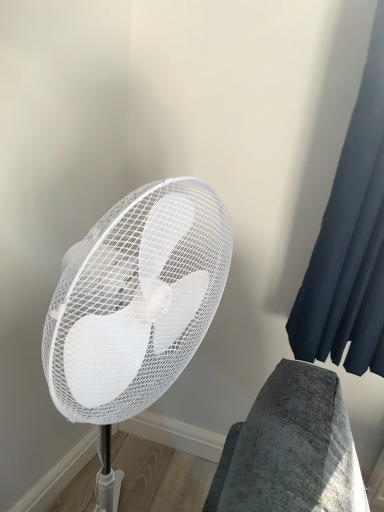
Question: Considering the positions of white mesh fan at center and dark blue fabric at right in the image, is white mesh fan at center wider or thinner than dark blue fabric at right?

Choices:
 (A) wide
 (B) thin

Answer: (A)

Question: Considering the positions of white mesh fan at center and dark blue fabric at right in the image, is white mesh fan at center bigger or smaller than dark blue fabric at right?

Choices:
 (A) small
 (B) big

Answer: (B)

Question: Is white mesh fan at center taller or shorter than dark blue fabric at right?

Choices:
 (A) short
 (B) tall

Answer: (B)

Question: Would you say dark blue fabric at right is to the left or to the right of white mesh fan at center in the picture?

Choices:
 (A) left
 (B) right

Answer: (B)

Question: Is dark blue fabric at right in front of or behind white mesh fan at center in the image?

Choices:
 (A) behind
 (B) front

Answer: (A)

Question: Do you think dark blue fabric at right is within white mesh fan at center, or outside of it?

Choices:
 (A) inside
 (B) outside

Answer: (B)

Question: Is dark blue fabric at right wider or thinner than white mesh fan at center?

Choices:
 (A) wide
 (B) thin

Answer: (B)